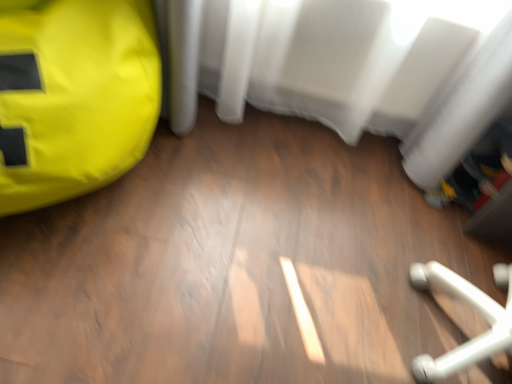
Find the location of a particular element. The image size is (512, 384). white sheer curtain at upper center is located at coordinates (337, 71).

Measure the distance between white sheer curtain at upper center and camera.

white sheer curtain at upper center is 1.17 meters away from camera.

Image resolution: width=512 pixels, height=384 pixels. Describe the element at coordinates (337, 71) in the screenshot. I see `white sheer curtain at upper center` at that location.

Describe the element at coordinates (73, 97) in the screenshot. The width and height of the screenshot is (512, 384). I see `yellow fabric bean bag at left` at that location.

Identify the location of yellow fabric bean bag at left. 73,97.

In order to face yellow fabric bean bag at left, should I rotate leftwards or rightwards?

You should look left and rotate roughly 29.266 degrees.

This screenshot has width=512, height=384. What are the coordinates of `white sheer curtain at upper center` in the screenshot? It's located at (337, 71).

Is white sheer curtain at upper center to the left or to the right of yellow fabric bean bag at left in the image?

Clearly, white sheer curtain at upper center is on the right of yellow fabric bean bag at left in the image.

Which object is closer to the camera taking this photo, white sheer curtain at upper center or yellow fabric bean bag at left?

yellow fabric bean bag at left is closer to the camera.

Which point is more distant from viewer, (252, 60) or (3, 100)?

The point (252, 60) is behind.

From the image's perspective, which one is positioned lower, white sheer curtain at upper center or yellow fabric bean bag at left?

yellow fabric bean bag at left, from the image's perspective.

Looking at this image, from a real-world perspective, which object rests below the other?

yellow fabric bean bag at left, from a real-world perspective.

Which object is wider, white sheer curtain at upper center or yellow fabric bean bag at left?

yellow fabric bean bag at left.

Considering the sizes of objects white sheer curtain at upper center and yellow fabric bean bag at left in the image provided, who is taller, white sheer curtain at upper center or yellow fabric bean bag at left?

With more height is yellow fabric bean bag at left.

Considering the relative sizes of white sheer curtain at upper center and yellow fabric bean bag at left in the image provided, is white sheer curtain at upper center bigger than yellow fabric bean bag at left?

No, white sheer curtain at upper center is not bigger than yellow fabric bean bag at left.

Is yellow fabric bean bag at left inside white sheer curtain at upper center?

Actually, yellow fabric bean bag at left is outside white sheer curtain at upper center.

Is white sheer curtain at upper center not close to yellow fabric bean bag at left?

white sheer curtain at upper center is actually quite close to yellow fabric bean bag at left.

Does white sheer curtain at upper center turn towards yellow fabric bean bag at left?

No.

Can you tell me how much white sheer curtain at upper center and yellow fabric bean bag at left differ in facing direction?

They differ by 0.0465 degrees in their facing directions.

Measure the distance from white sheer curtain at upper center to yellow fabric bean bag at left.

white sheer curtain at upper center is 18.83 inches from yellow fabric bean bag at left.

The image size is (512, 384). Find the location of `bean bag chair in front of the white sheer curtain at upper center`. bean bag chair in front of the white sheer curtain at upper center is located at coordinates (73, 97).

Considering the positions of objects yellow fabric bean bag at left and white sheer curtain at upper center in the image provided, who is more to the right, yellow fabric bean bag at left or white sheer curtain at upper center?

white sheer curtain at upper center.

Which is in front, yellow fabric bean bag at left or white sheer curtain at upper center?

yellow fabric bean bag at left is in front.

Considering the points (10, 136) and (313, 115), which point is behind, point (10, 136) or point (313, 115)?

The point (313, 115) is behind.

From the image's perspective, does yellow fabric bean bag at left appear lower than white sheer curtain at upper center?

Yes, from the image's perspective, yellow fabric bean bag at left is below white sheer curtain at upper center.

From a real-world perspective, between yellow fabric bean bag at left and white sheer curtain at upper center, who is vertically higher?

white sheer curtain at upper center, from a real-world perspective.

Considering the sizes of objects yellow fabric bean bag at left and white sheer curtain at upper center in the image provided, who is thinner, yellow fabric bean bag at left or white sheer curtain at upper center?

With smaller width is white sheer curtain at upper center.

Between yellow fabric bean bag at left and white sheer curtain at upper center, which one has more height?

With more height is yellow fabric bean bag at left.

Which of these two, yellow fabric bean bag at left or white sheer curtain at upper center, is bigger?

With larger size is yellow fabric bean bag at left.

Would you say yellow fabric bean bag at left is inside or outside white sheer curtain at upper center?

yellow fabric bean bag at left is spatially situated outside white sheer curtain at upper center.

Is yellow fabric bean bag at left next to white sheer curtain at upper center and touching it?

No.

Is yellow fabric bean bag at left facing away from white sheer curtain at upper center?

No, yellow fabric bean bag at left is not facing the opposite direction of white sheer curtain at upper center.

Find the location of a particular element. This screenshot has width=512, height=384. bean bag chair below the white sheer curtain at upper center (from the image's perspective) is located at coordinates (73, 97).

At what (x,y) coordinates should I click in order to perform the action: click on bean bag chair on the left side of white sheer curtain at upper center. Please return your answer as a coordinate pair (x, y). Looking at the image, I should click on (73, 97).

This screenshot has width=512, height=384. Find the location of `bean bag chair below the white sheer curtain at upper center (from a real-world perspective)`. bean bag chair below the white sheer curtain at upper center (from a real-world perspective) is located at coordinates (73, 97).